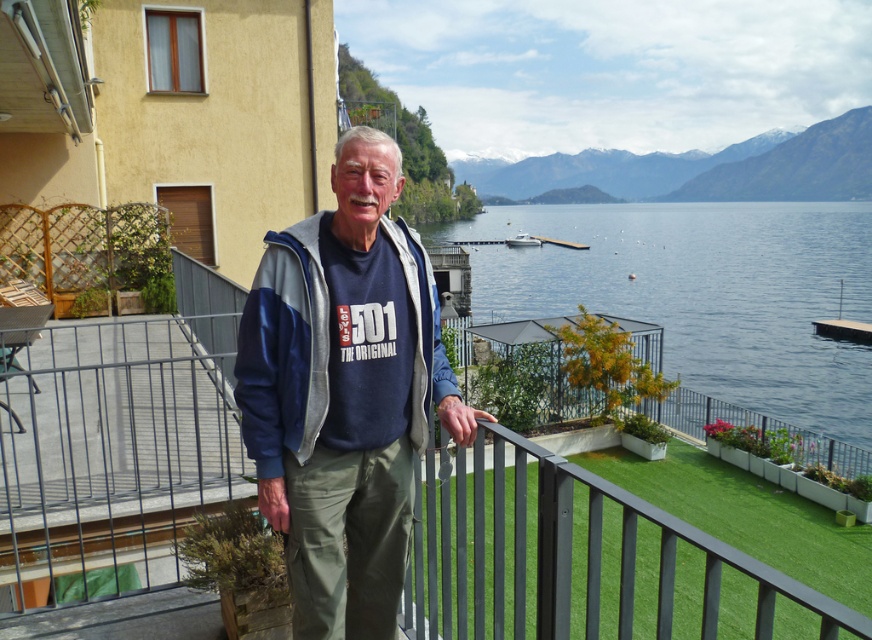
Is matte blue jacket at center further to camera compared to blue water at center?

No, it is not.

Between point (426, 264) and point (693, 298), which one is positioned in front?

Point (426, 264) is in front.

Is point (298, 264) closer to viewer compared to point (828, 417)?

That is True.

The height and width of the screenshot is (640, 872). What are the coordinates of `matte blue jacket at center` in the screenshot? It's located at (344, 392).

From the picture: Who is lower down, blue water at center or blue fleece sweatshirt at center?

blue fleece sweatshirt at center

Does point (479, 298) lie in front of point (427, 266)?

No, it is behind (427, 266).

Where is `blue water at center`? This screenshot has width=872, height=640. blue water at center is located at coordinates (702, 292).

Can you confirm if matte blue jacket at center is taller than white glossy boat at center?

In fact, matte blue jacket at center may be shorter than white glossy boat at center.

Does matte blue jacket at center appear on the left side of white glossy boat at center?

Correct, you'll find matte blue jacket at center to the left of white glossy boat at center.

Image resolution: width=872 pixels, height=640 pixels. In order to click on matte blue jacket at center in this screenshot , I will do `click(344, 392)`.

Locate an element on the screen. matte blue jacket at center is located at coordinates (344, 392).